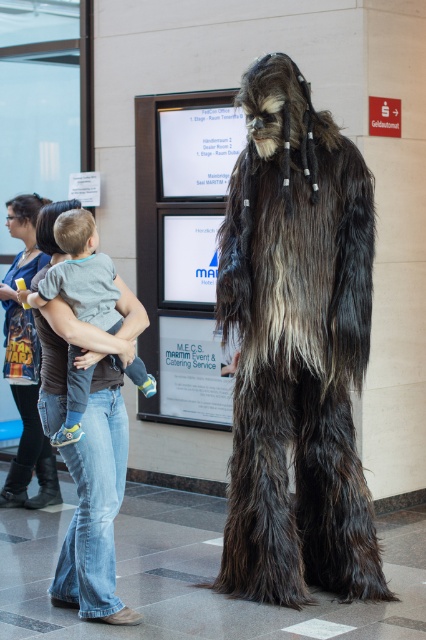
You are a photographer at the event and want to capture both the fuzzy brown costume at center and the gray cotton shirt at center in a single frame. Which object should you focus on first to ensure both are in the frame?

The fuzzy brown costume at center is bigger than the gray cotton shirt at center, so focus on the fuzzy brown costume at center first to ensure both are in the frame.

You are a security guard in the building and need to locate the fuzzy brown costume at center. According to the map, where is it positioned?

The fuzzy brown costume at center is located at coordinates point (296, 348).

From the picture: You are standing in the public building and want to take a photo of the Chewbacca costume. You notice two points marked in the scene. One is at point [253,436] and the other at point [60,228]. Which point is closer to your camera position?

Point [60,228] is closer to the camera position because the description states that point [253,436] is further away than point [60,228].